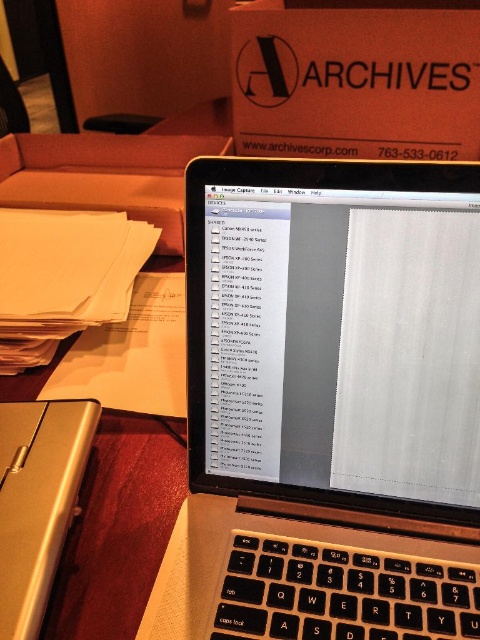
You are organizing items on your desk and need to place the matte black cardboard box at upper center and the silver metallic case at lower left into a drawer. The drawer has a width of 30 cm. Can both items fit side by side horizontally?

The matte black cardboard box at upper center is larger in size than the silver metallic case at lower left. However, without knowing the exact dimensions of both items, it is impossible to determine if they can fit side by side in the drawer.

You are standing in front of the workspace and want to place a small sticker on the desk. You have two points marked on the desk, point (395,332) and point (362,81). Which point is closer to you where you should place the sticker first?

Point (395,332) is closer to the viewer than point (362,81), so you should place the sticker on point (395,332) first.